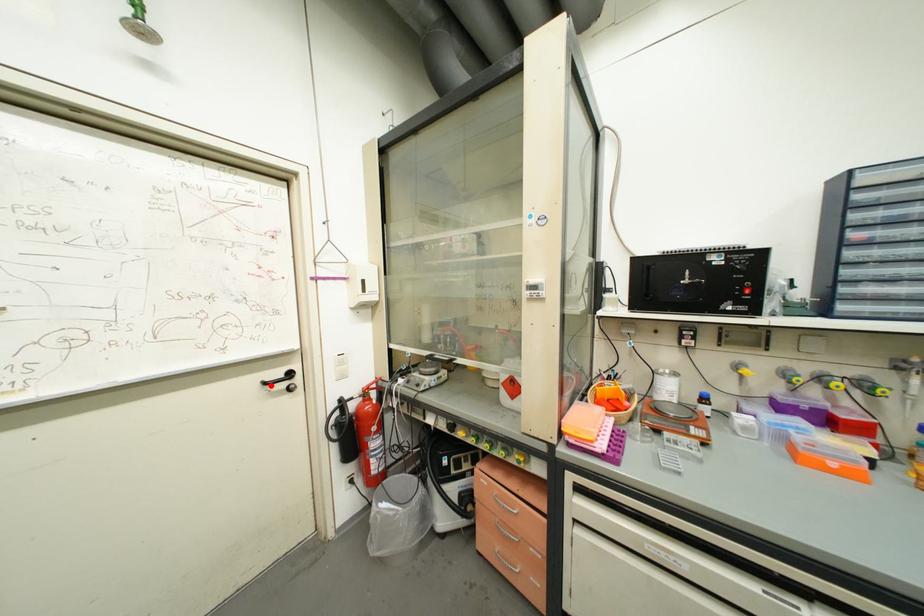
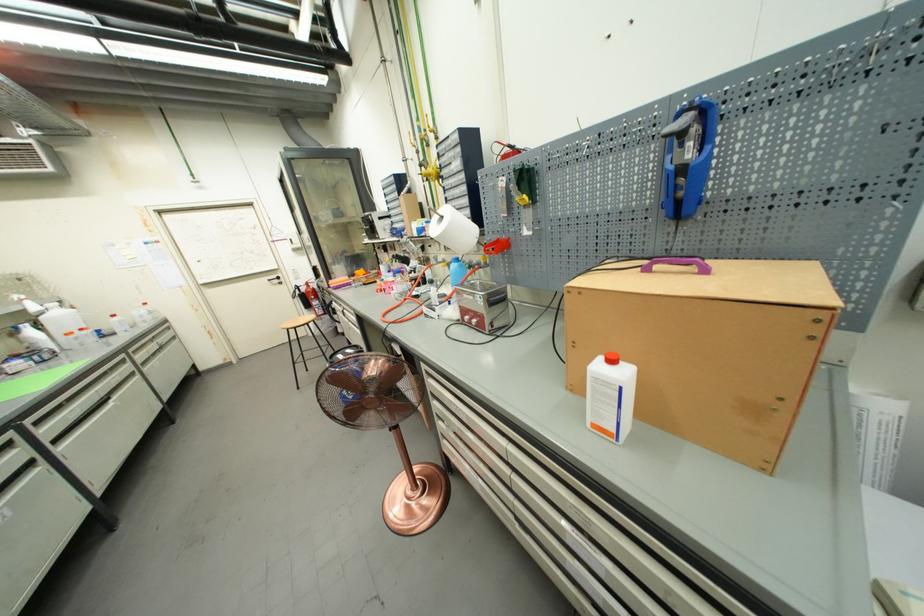
Question: I am providing you with two images of the same scene from different viewpoints. Image1 has a red point marked. In image2, the corresponding 3D location appears at what relative position? Reply with the corresponding letter.

Choices:
 (A) Closer
 (B) Farther

Answer: (A)